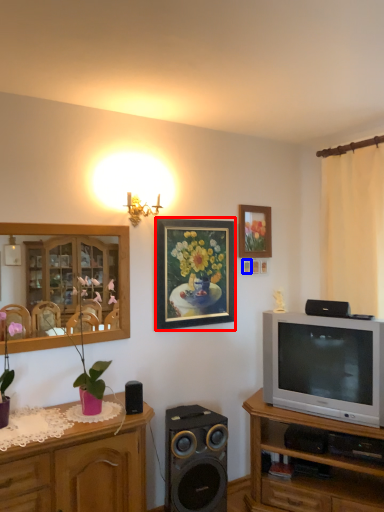
Question: Which object appears closest to the camera in this image, picture frame (highlighted by a red box) or picture frame (highlighted by a blue box)?

Choices:
 (A) picture frame
 (B) picture frame

Answer: (A)